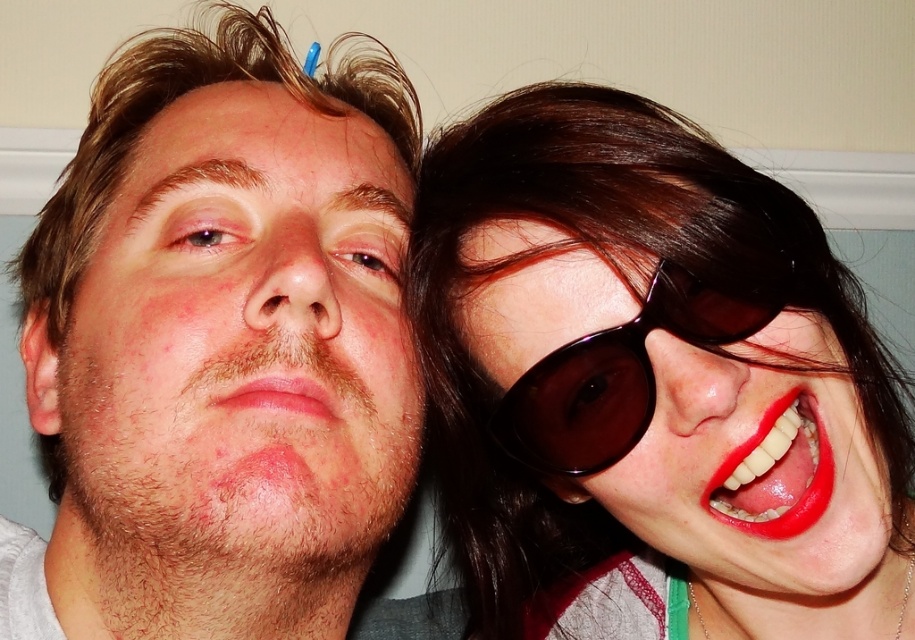
Question: Which point appears farthest from the camera in this image?

Choices:
 (A) (480, 301)
 (B) (795, 525)

Answer: (A)

Question: Does shiny brown hair at upper right have a lesser width compared to pink matte lips at center?

Choices:
 (A) yes
 (B) no

Answer: (B)

Question: Is smooth skin face at center bigger than black shiny sunglasses at right?

Choices:
 (A) yes
 (B) no

Answer: (A)

Question: Which object is farther from the camera taking this photo?

Choices:
 (A) glossy red lipstick at lower right
 (B) smooth skin face at center

Answer: (B)

Question: Which object appears farthest from the camera in this image?

Choices:
 (A) smooth skin face at center
 (B) shiny brown hair at upper right

Answer: (A)

Question: Can you confirm if smooth skin face at center is wider than pink matte lips at center?

Choices:
 (A) no
 (B) yes

Answer: (B)